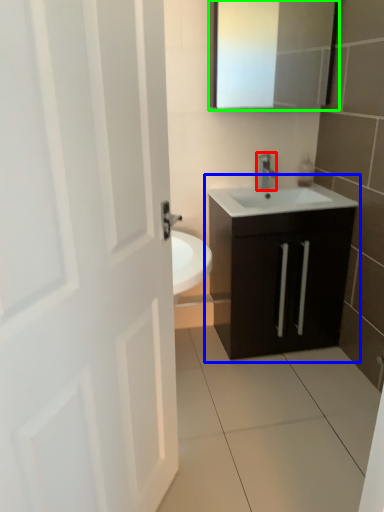
Question: Based on their relative distances, which object is nearer to tap (highlighted by a red box)? Choose from bathroom cabinet (highlighted by a blue box) and medicine cabinet (highlighted by a green box).

Choices:
 (A) bathroom cabinet
 (B) medicine cabinet

Answer: (A)